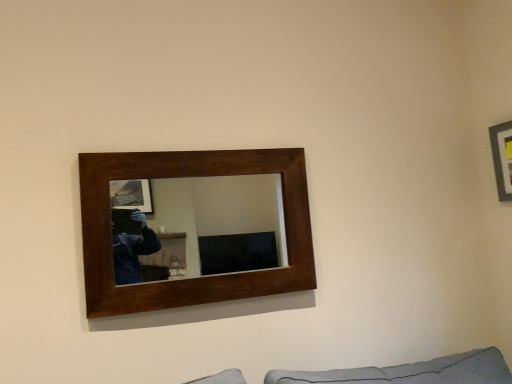
Measure the distance between point (99, 153) and camera.

Point (99, 153) and camera are 1.62 meters apart.

The width and height of the screenshot is (512, 384). Identify the location of dark wood/matte picture frame at upper center, the first picture frame positioned from the left. 199,277.

What is the approximate width of dark wood/matte picture frame at upper center, the 2th picture frame in the right-to-left sequence?

2.70 inches.

Describe the element at coordinates (199, 277) in the screenshot. I see `dark wood/matte picture frame at upper center, the 2th picture frame in the right-to-left sequence` at that location.

Find the location of `wooden picture frame at upper right, acting as the first picture frame starting from the right`. wooden picture frame at upper right, acting as the first picture frame starting from the right is located at coordinates (502, 158).

The image size is (512, 384). Describe the element at coordinates (502, 158) in the screenshot. I see `wooden picture frame at upper right, acting as the 2th picture frame starting from the left` at that location.

The height and width of the screenshot is (384, 512). What are the coordinates of `dark wood/matte picture frame at upper center, the first picture frame positioned from the left` in the screenshot? It's located at (199, 277).

Based on their positions, is dark wood/matte picture frame at upper center, the 2th picture frame in the right-to-left sequence, located to the left or right of wooden picture frame at upper right, acting as the first picture frame starting from the right?

Clearly, dark wood/matte picture frame at upper center, the 2th picture frame in the right-to-left sequence, is on the left of wooden picture frame at upper right, acting as the first picture frame starting from the right, in the image.

Relative to wooden picture frame at upper right, acting as the first picture frame starting from the right, is dark wood/matte picture frame at upper center, the first picture frame positioned from the left, in front or behind?

Visually, dark wood/matte picture frame at upper center, the first picture frame positioned from the left, is located in front of wooden picture frame at upper right, acting as the first picture frame starting from the right.

Considering the positions of point (293, 153) and point (511, 163), is point (293, 153) closer or farther from the camera than point (511, 163)?

Point (293, 153) is closer to the camera than point (511, 163).

From the image's perspective, is dark wood/matte picture frame at upper center, the 2th picture frame in the right-to-left sequence, on top of wooden picture frame at upper right, acting as the 2th picture frame starting from the left?

No.

From a real-world perspective, is dark wood/matte picture frame at upper center, the 2th picture frame in the right-to-left sequence, located beneath wooden picture frame at upper right, acting as the 2th picture frame starting from the left?

Indeed, from a real-world perspective, dark wood/matte picture frame at upper center, the 2th picture frame in the right-to-left sequence, is positioned beneath wooden picture frame at upper right, acting as the 2th picture frame starting from the left.

Can you confirm if dark wood/matte picture frame at upper center, the 2th picture frame in the right-to-left sequence, is wider than wooden picture frame at upper right, acting as the 2th picture frame starting from the left?

Yes.

In the scene shown: From their relative heights in the image, would you say dark wood/matte picture frame at upper center, the first picture frame positioned from the left, is taller or shorter than wooden picture frame at upper right, acting as the 2th picture frame starting from the left?

dark wood/matte picture frame at upper center, the first picture frame positioned from the left, is taller than wooden picture frame at upper right, acting as the 2th picture frame starting from the left.

Considering the relative sizes of dark wood/matte picture frame at upper center, the 2th picture frame in the right-to-left sequence, and wooden picture frame at upper right, acting as the 2th picture frame starting from the left, in the image provided, is dark wood/matte picture frame at upper center, the 2th picture frame in the right-to-left sequence, smaller than wooden picture frame at upper right, acting as the 2th picture frame starting from the left,?

No.

From the picture: Do you think dark wood/matte picture frame at upper center, the 2th picture frame in the right-to-left sequence, is within wooden picture frame at upper right, acting as the first picture frame starting from the right, or outside of it?

The correct answer is: outside.

Is dark wood/matte picture frame at upper center, the first picture frame positioned from the left, touching wooden picture frame at upper right, acting as the 2th picture frame starting from the left?

There is a gap between dark wood/matte picture frame at upper center, the first picture frame positioned from the left, and wooden picture frame at upper right, acting as the 2th picture frame starting from the left.

Is dark wood/matte picture frame at upper center, the 2th picture frame in the right-to-left sequence, oriented away from wooden picture frame at upper right, acting as the 2th picture frame starting from the left?

dark wood/matte picture frame at upper center, the 2th picture frame in the right-to-left sequence, does not have its back to wooden picture frame at upper right, acting as the 2th picture frame starting from the left.

How far apart are dark wood/matte picture frame at upper center, the first picture frame positioned from the left, and wooden picture frame at upper right, acting as the 2th picture frame starting from the left?

They are 4.10 feet apart.

Find the location of `picture frame located on the right of dark wood/matte picture frame at upper center, the first picture frame positioned from the left`. picture frame located on the right of dark wood/matte picture frame at upper center, the first picture frame positioned from the left is located at coordinates (502, 158).

Considering the positions of objects wooden picture frame at upper right, acting as the 2th picture frame starting from the left, and dark wood/matte picture frame at upper center, the first picture frame positioned from the left, in the image provided, who is more to the left, wooden picture frame at upper right, acting as the 2th picture frame starting from the left, or dark wood/matte picture frame at upper center, the first picture frame positioned from the left,?

Positioned to the left is dark wood/matte picture frame at upper center, the first picture frame positioned from the left.

Considering the positions of objects wooden picture frame at upper right, acting as the first picture frame starting from the right, and dark wood/matte picture frame at upper center, the 2th picture frame in the right-to-left sequence, in the image provided, who is behind, wooden picture frame at upper right, acting as the first picture frame starting from the right, or dark wood/matte picture frame at upper center, the 2th picture frame in the right-to-left sequence,?

Positioned behind is wooden picture frame at upper right, acting as the first picture frame starting from the right.

Does point (497, 144) appear closer or farther from the camera than point (208, 162)?

Clearly, point (497, 144) is more distant from the camera than point (208, 162).

From the image's perspective, is wooden picture frame at upper right, acting as the 2th picture frame starting from the left, on dark wood/matte picture frame at upper center, the 2th picture frame in the right-to-left sequence?

Yes, from the image's perspective, wooden picture frame at upper right, acting as the 2th picture frame starting from the left, is over dark wood/matte picture frame at upper center, the 2th picture frame in the right-to-left sequence.

From a real-world perspective, is wooden picture frame at upper right, acting as the first picture frame starting from the right, physically above dark wood/matte picture frame at upper center, the first picture frame positioned from the left?

Yes, from a real-world perspective, wooden picture frame at upper right, acting as the first picture frame starting from the right, is over dark wood/matte picture frame at upper center, the first picture frame positioned from the left

Which of these two, wooden picture frame at upper right, acting as the first picture frame starting from the right, or dark wood/matte picture frame at upper center, the first picture frame positioned from the left, is wider?

With larger width is dark wood/matte picture frame at upper center, the first picture frame positioned from the left.

Considering the relative sizes of wooden picture frame at upper right, acting as the first picture frame starting from the right, and dark wood/matte picture frame at upper center, the first picture frame positioned from the left, in the image provided, is wooden picture frame at upper right, acting as the first picture frame starting from the right, shorter than dark wood/matte picture frame at upper center, the first picture frame positioned from the left,?

Correct, wooden picture frame at upper right, acting as the first picture frame starting from the right, is not as tall as dark wood/matte picture frame at upper center, the first picture frame positioned from the left.

Can you confirm if wooden picture frame at upper right, acting as the 2th picture frame starting from the left, is smaller than dark wood/matte picture frame at upper center, the 2th picture frame in the right-to-left sequence?

Yes.

Consider the image. Is wooden picture frame at upper right, acting as the first picture frame starting from the right, inside or outside of dark wood/matte picture frame at upper center, the first picture frame positioned from the left?

wooden picture frame at upper right, acting as the first picture frame starting from the right, is outside dark wood/matte picture frame at upper center, the first picture frame positioned from the left.

Consider the image. Would you say wooden picture frame at upper right, acting as the first picture frame starting from the right, is a long distance from dark wood/matte picture frame at upper center, the 2th picture frame in the right-to-left sequence?

Indeed, wooden picture frame at upper right, acting as the first picture frame starting from the right, is not near dark wood/matte picture frame at upper center, the 2th picture frame in the right-to-left sequence.

Does wooden picture frame at upper right, acting as the first picture frame starting from the right, turn towards dark wood/matte picture frame at upper center, the 2th picture frame in the right-to-left sequence?

Yes, wooden picture frame at upper right, acting as the first picture frame starting from the right, is oriented towards dark wood/matte picture frame at upper center, the 2th picture frame in the right-to-left sequence.

Image resolution: width=512 pixels, height=384 pixels. I want to click on picture frame located above the dark wood/matte picture frame at upper center, the 2th picture frame in the right-to-left sequence (from a real-world perspective), so coord(502,158).

Where is `picture frame below the wooden picture frame at upper right, acting as the 2th picture frame starting from the left (from the image's perspective)`? picture frame below the wooden picture frame at upper right, acting as the 2th picture frame starting from the left (from the image's perspective) is located at coordinates (199, 277).

This screenshot has height=384, width=512. What are the coordinates of `picture frame in front of the wooden picture frame at upper right, acting as the 2th picture frame starting from the left` in the screenshot? It's located at (199, 277).